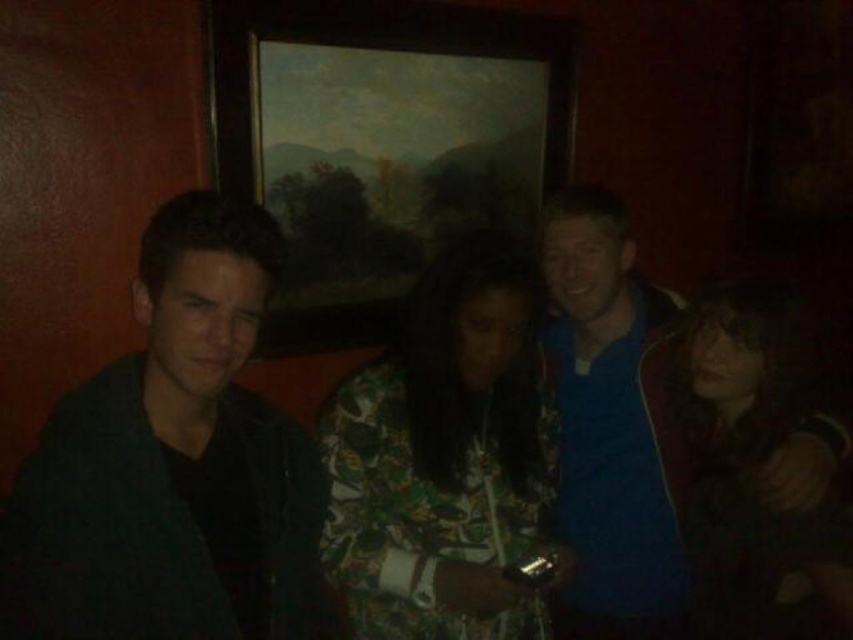
Can you confirm if wooden framed painting at upper center is positioned to the right of floral-patterned dress at center?

In fact, wooden framed painting at upper center is to the left of floral-patterned dress at center.

Is wooden framed painting at upper center positioned in front of floral-patterned dress at center?

That is False.

Find the location of a particular element. wooden framed painting at upper center is located at coordinates (381, 141).

At what (x,y) coordinates should I click in order to perform the action: click on wooden framed painting at upper center. Please return your answer as a coordinate pair (x, y). This screenshot has height=640, width=853. Looking at the image, I should click on (381, 141).

Can you confirm if floral-patterned dress at center is smaller than fluffy brown hair at center?

No.

Which is above, floral-patterned dress at center or fluffy brown hair at center?

floral-patterned dress at center is higher up.

Is point (483, 611) closer to viewer compared to point (747, 449)?

Yes, it is.

I want to click on floral-patterned dress at center, so click(445, 456).

Which is below, fluffy brown hair at center or blue fabric jacket at right?

fluffy brown hair at center is below.

Which is in front, point (840, 556) or point (566, 205)?

Positioned in front is point (840, 556).

At what (x,y) coordinates should I click in order to perform the action: click on fluffy brown hair at center. Please return your answer as a coordinate pair (x, y). The image size is (853, 640). Looking at the image, I should click on (759, 468).